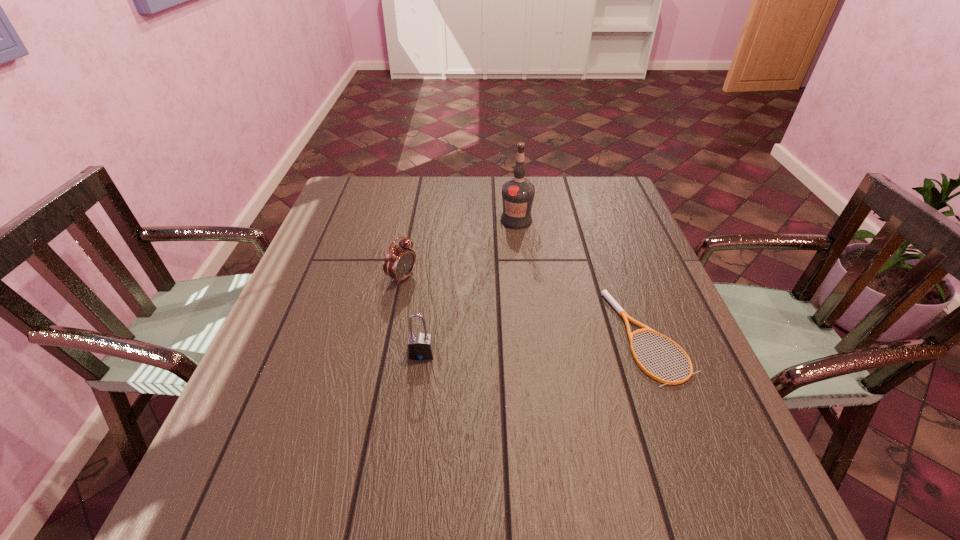
You are a GUI agent. You are given a task and a screenshot of the screen. Output one action in this format:
    pyautogui.click(x=<x>, y=<y>)
    Task: Click on the padlock
    
    Given the screenshot: What is the action you would take?
    pyautogui.click(x=420, y=346)

The height and width of the screenshot is (540, 960). I want to click on tennis racket, so 610,299.

Locate an element on the screen. This screenshot has width=960, height=540. the shortest object is located at coordinates (610, 299).

This screenshot has width=960, height=540. What are the coordinates of `vodka` in the screenshot? It's located at (518, 193).

You are a GUI agent. You are given a task and a screenshot of the screen. Output one action in this format:
    pyautogui.click(x=<x>, y=<y>)
    Task: Click on the farthest object
    The height and width of the screenshot is (540, 960).
    Given the screenshot: What is the action you would take?
    pyautogui.click(x=518, y=193)

Identify the location of the leftmost object. (399, 262).

The width and height of the screenshot is (960, 540). What are the coordinates of `alarm clock` in the screenshot? It's located at (399, 262).

At what (x,y) coordinates should I click in order to perform the action: click on free space located on the shackle of the third object from right to left. Please return your answer as a coordinate pair (x, y). Image resolution: width=960 pixels, height=540 pixels. Looking at the image, I should click on (410, 447).

At what (x,y) coordinates should I click in order to perform the action: click on free spot located 0.190m on the back of the tennis racket. Please return your answer as a coordinate pair (x, y). The width and height of the screenshot is (960, 540). Looking at the image, I should click on click(614, 247).

The height and width of the screenshot is (540, 960). What are the coordinates of `free space located on the front label of the tallest object` in the screenshot? It's located at (556, 332).